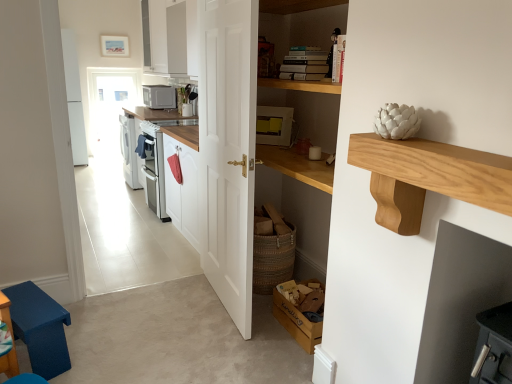
Question: Can you confirm if blue fabric step stool at lower left is positioned to the left of white wooden door at center?

Choices:
 (A) yes
 (B) no

Answer: (A)

Question: Is blue fabric step stool at lower left positioned beyond the bounds of white wooden door at center?

Choices:
 (A) yes
 (B) no

Answer: (A)

Question: Can you confirm if blue fabric step stool at lower left is thinner than white wooden door at center?

Choices:
 (A) yes
 (B) no

Answer: (B)

Question: From a real-world perspective, does blue fabric step stool at lower left sit lower than white wooden door at center?

Choices:
 (A) no
 (B) yes

Answer: (B)

Question: From the image's perspective, does blue fabric step stool at lower left appear lower than white wooden door at center?

Choices:
 (A) yes
 (B) no

Answer: (A)

Question: Relative to wooden cardboard box at lower center, is white wooden door at center in front or behind?

Choices:
 (A) front
 (B) behind

Answer: (A)

Question: Is white wooden door at center situated inside wooden cardboard box at lower center or outside?

Choices:
 (A) inside
 (B) outside

Answer: (B)

Question: Is point (212, 155) closer or farther from the camera than point (281, 309)?

Choices:
 (A) farther
 (B) closer

Answer: (A)

Question: From their relative heights in the image, would you say white wooden door at center is taller or shorter than wooden cardboard box at lower center?

Choices:
 (A) short
 (B) tall

Answer: (B)

Question: From a real-world perspective, is wooden cardboard box at lower center physically located above or below matte yellow appliance at center, which is the first appliance in right-to-left order?

Choices:
 (A) below
 (B) above

Answer: (A)

Question: Which is correct: wooden cardboard box at lower center is inside matte yellow appliance at center, the 2th appliance positioned from the left, or outside of it?

Choices:
 (A) outside
 (B) inside

Answer: (A)

Question: In terms of width, does wooden cardboard box at lower center look wider or thinner when compared to matte yellow appliance at center, which ranks as the second appliance in back-to-front order?

Choices:
 (A) thin
 (B) wide

Answer: (B)

Question: Looking at the image, does wooden cardboard box at lower center seem bigger or smaller compared to matte yellow appliance at center, which ranks as the second appliance in back-to-front order?

Choices:
 (A) small
 (B) big

Answer: (B)

Question: From a real-world perspective, is wooden cardboard box at lower center physically located above or below matte gray microwave at upper center, acting as the second appliance starting from the right?

Choices:
 (A) above
 (B) below

Answer: (B)

Question: From the image's perspective, is wooden cardboard box at lower center above or below matte gray microwave at upper center, positioned as the 1th appliance in top-to-bottom order?

Choices:
 (A) below
 (B) above

Answer: (A)